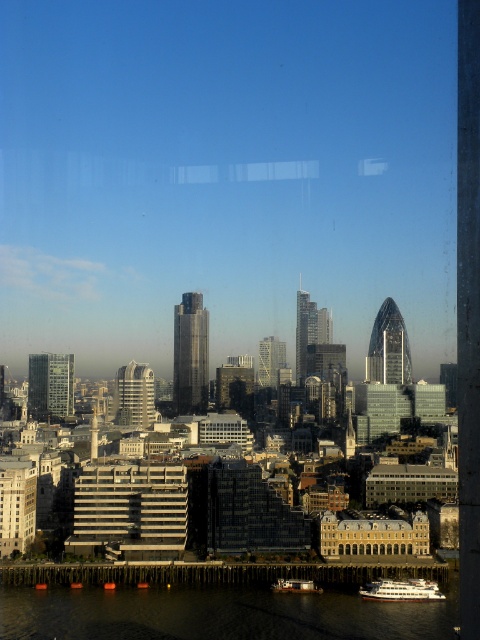
Question: Which point is farther to the camera?

Choices:
 (A) white glossy boat at lower right
 (B) metallic gray boat at lower center

Answer: (B)

Question: Is dark water at lower center in front of white glossy boat at lower right?

Choices:
 (A) yes
 (B) no

Answer: (A)

Question: Among these points, which one is nearest to the camera?

Choices:
 (A) (84, 589)
 (B) (309, 593)

Answer: (B)

Question: Is white glossy boat at lower right wider than metallic gray boat at lower center?

Choices:
 (A) no
 (B) yes

Answer: (B)

Question: Which object is closer to the camera taking this photo?

Choices:
 (A) dark water at lower center
 (B) white glossy boat at lower right
 (C) metallic gray boat at lower center

Answer: (A)

Question: Does dark water at lower center appear on the left side of white glossy boat at lower right?

Choices:
 (A) no
 (B) yes

Answer: (B)